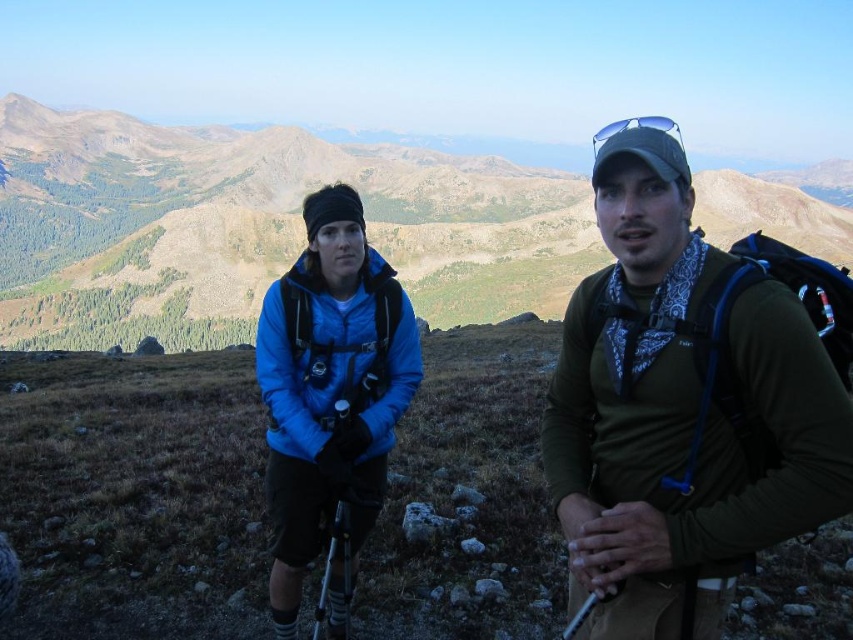
Question: Among these points, which one is farthest from the camera?

Choices:
 (A) (727, 545)
 (B) (131, 172)

Answer: (B)

Question: Considering the real-world distances, which object is closest to the matte blue jacket at center?

Choices:
 (A) green matte shirt at center
 (B) smooth brown mountain at center

Answer: (A)

Question: Is smooth brown mountain at center above matte blue jacket at center?

Choices:
 (A) yes
 (B) no

Answer: (A)

Question: Is green matte shirt at center smaller than smooth brown mountain at center?

Choices:
 (A) no
 (B) yes

Answer: (B)

Question: Which point is farther to the camera?

Choices:
 (A) (625, 579)
 (B) (368, 444)

Answer: (B)

Question: Is green matte shirt at center wider than matte blue jacket at center?

Choices:
 (A) yes
 (B) no

Answer: (B)